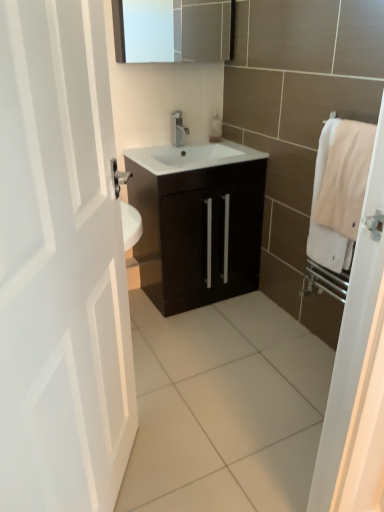
Image resolution: width=384 pixels, height=512 pixels. Find the location of `free space to the left of satin nickel faucet at center`. free space to the left of satin nickel faucet at center is located at coordinates point(157,148).